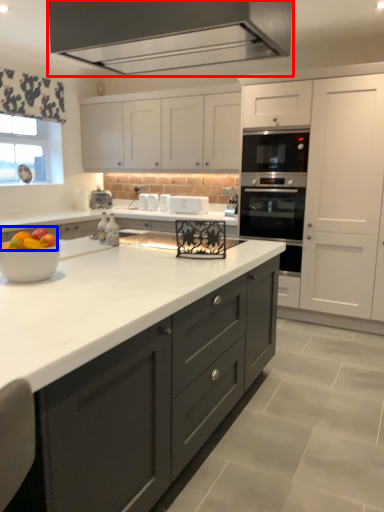
Question: Which of the following is the closest to the observer, exhaust hood (highlighted by a red box) or fruit (highlighted by a blue box)?

Choices:
 (A) exhaust hood
 (B) fruit

Answer: (B)